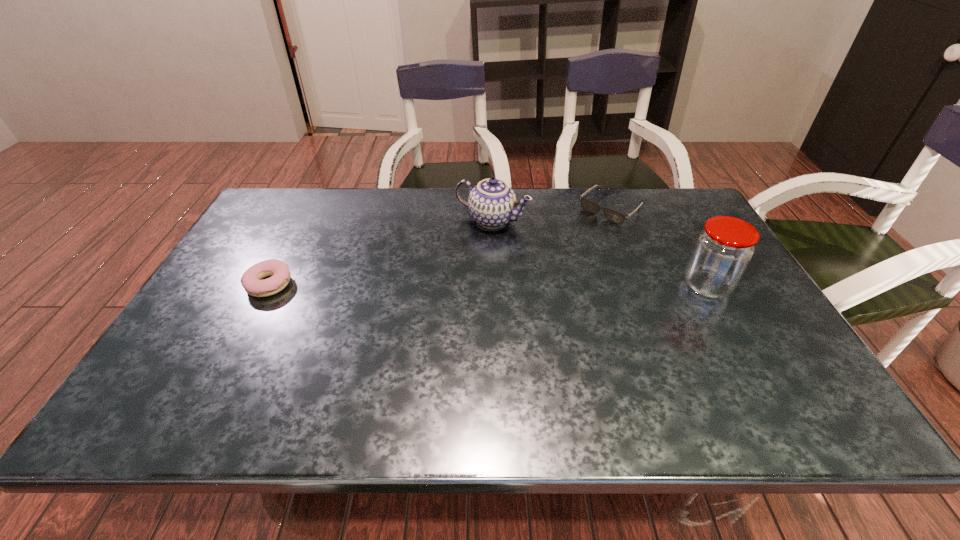
Find the location of a particular element. This screenshot has height=540, width=960. free space on the desktop that is between the leftmost object and the rightmost object and is positioned on the front-facing side of the third object from left to right is located at coordinates click(518, 286).

Locate an element on the screen. This screenshot has width=960, height=540. vacant space on the desktop that is between the doughnut and the jar and is positioned at the spout of the chinaware is located at coordinates 436,285.